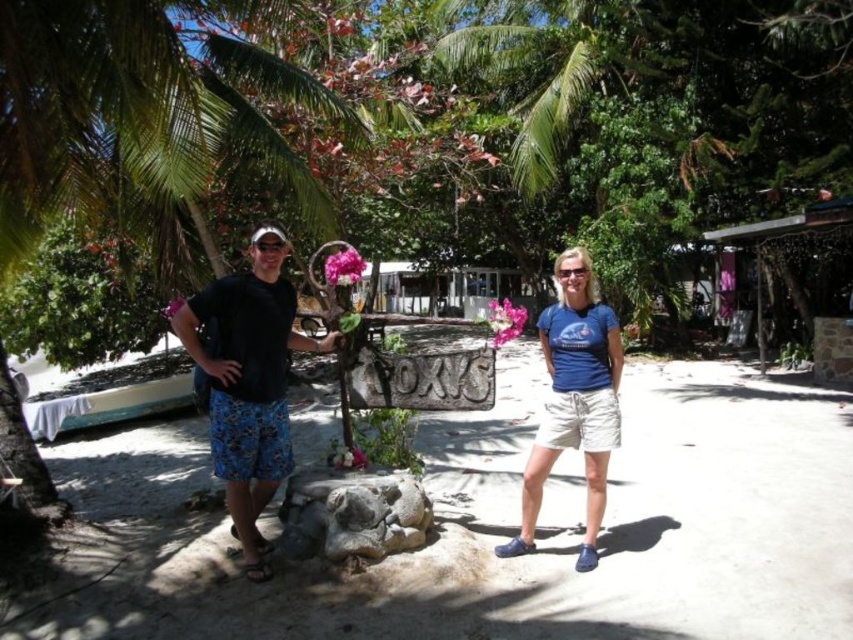
Can you confirm if black fabric shirt at center is positioned to the left of blue cotton t-shirt at center?

Correct, you'll find black fabric shirt at center to the left of blue cotton t-shirt at center.

Can you confirm if black fabric shirt at center is thinner than blue cotton t-shirt at center?

Incorrect, black fabric shirt at center's width is not less than blue cotton t-shirt at center's.

The width and height of the screenshot is (853, 640). What are the coordinates of `black fabric shirt at center` in the screenshot? It's located at (576, 403).

Does rustic stone signpost at center appear over black plastic goggles at left?

No.

In order to click on rustic stone signpost at center in this screenshot , I will do `click(498, 529)`.

Who is more distant from viewer, (821, 428) or (281, 250)?

The point (821, 428) is more distant.

Find the location of a particular element. This screenshot has height=640, width=853. rustic stone signpost at center is located at coordinates (498, 529).

Who is taller, black plastic goggles at left or transparent plastic goggles at center?

black plastic goggles at left

Find the location of a particular element. black plastic goggles at left is located at coordinates (270, 244).

Between point (276, 237) and point (583, 266), which one is positioned in front?

Point (276, 237) is in front.

The image size is (853, 640). I want to click on black plastic goggles at left, so click(x=270, y=244).